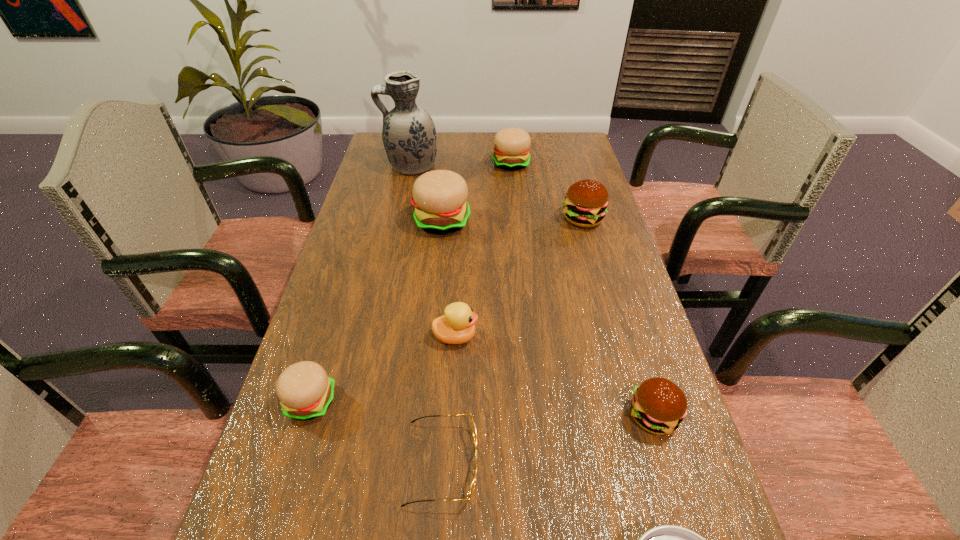
This screenshot has width=960, height=540. I want to click on the nearest beige hamburger, so click(305, 391).

The image size is (960, 540). Identify the location of the leftmost beige hamburger. (305, 391).

What are the coordinates of `gold spectacles` in the screenshot? It's located at (474, 432).

Identify the location of the shortest object. (474, 432).

Identify the location of vacant area situated 0.270m on the front of the biggest beige hamburger. (433, 312).

This screenshot has height=540, width=960. In order to click on vacant space located on the front of the bigger brown hamburger in this screenshot , I will do `click(619, 348)`.

The width and height of the screenshot is (960, 540). What are the coordinates of `free spot located 0.090m on the front of the farthest hamburger` in the screenshot? It's located at (514, 188).

At what (x,y) coordinates should I click in order to perform the action: click on vacant region located 0.100m on the face of the fifth farthest object. Please return your answer as a coordinate pair (x, y). The height and width of the screenshot is (540, 960). Looking at the image, I should click on (523, 336).

Find the location of a particular element. The width and height of the screenshot is (960, 540). vacant region located 0.380m on the back of the smaller brown hamburger is located at coordinates (607, 264).

Find the location of a particular element. This screenshot has width=960, height=540. vacant region located 0.060m on the front of the smallest beige hamburger is located at coordinates (294, 456).